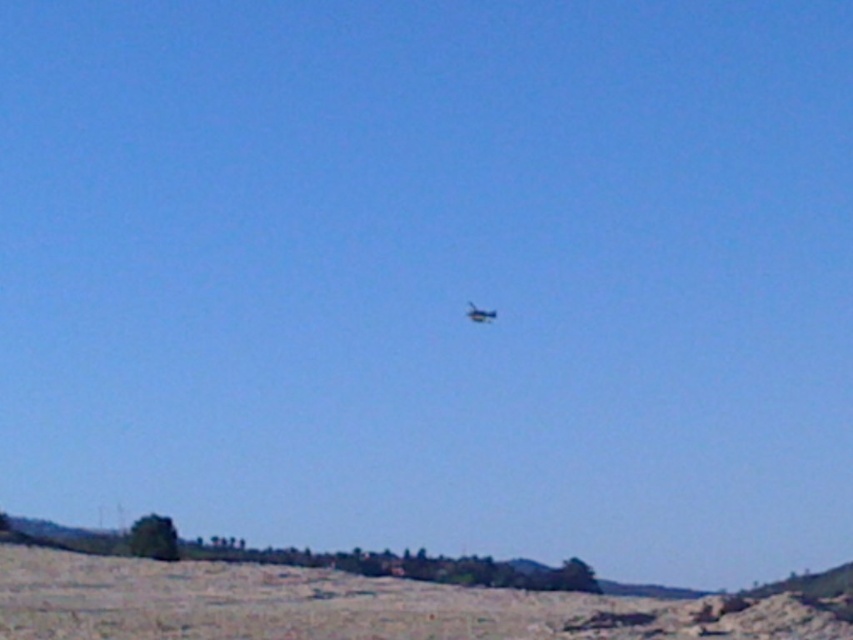
Question: Does metallic blue helicopter at center appear on the right side of shiny blue airplane at center?

Choices:
 (A) no
 (B) yes

Answer: (B)

Question: Is brown sandy dirt field at lower center to the left of metallic blue helicopter at center from the viewer's perspective?

Choices:
 (A) yes
 (B) no

Answer: (A)

Question: Which of the following is the closest to the observer?

Choices:
 (A) (703, 604)
 (B) (473, 304)
 (C) (480, 316)

Answer: (A)

Question: Does brown sandy dirt field at lower center have a lesser width compared to shiny blue airplane at center?

Choices:
 (A) no
 (B) yes

Answer: (A)

Question: Which of the following is the farthest from the observer?

Choices:
 (A) shiny blue airplane at center
 (B) metallic blue helicopter at center

Answer: (A)

Question: Which object is positioned farthest from the metallic blue helicopter at center?

Choices:
 (A) shiny blue airplane at center
 (B) brown sandy dirt field at lower center

Answer: (B)